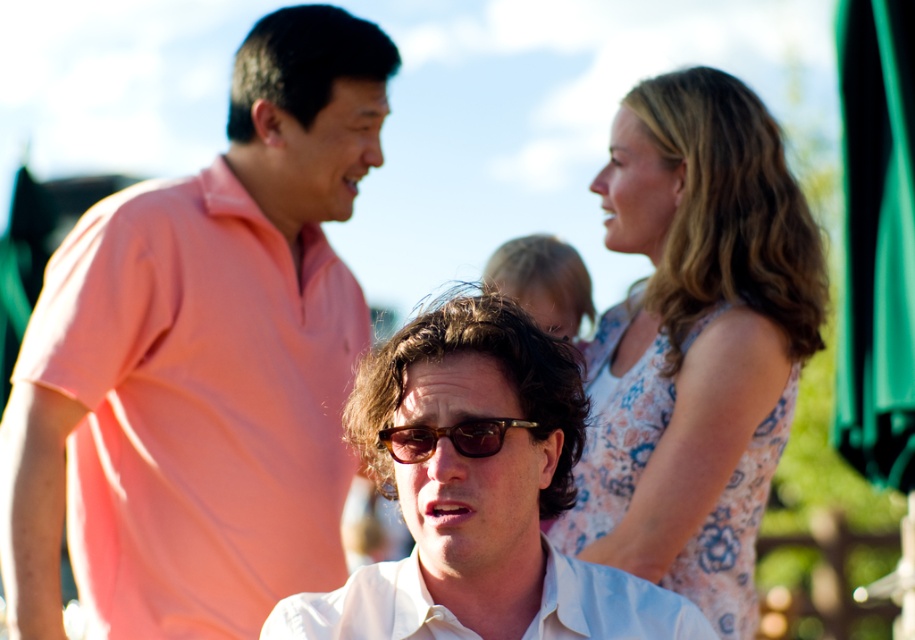
You are standing at the origin of the coordinate system in the image. You see two points labeled as point (138, 372) and point (417, 429). Which point is closer to you?

Point (417, 429) is closer to you because it is in front of point (138, 372).

You are organizing a photo shoot and need to position the models so that the floral dress at upper right and the white cotton shirt at center are visible in the frame. Based on their current positions, which model is higher up in the image?

The floral dress at upper right is located above the white cotton shirt at center, so the model wearing the floral dress at upper right is higher up in the image.

You are organizing a photo shoot and need to ensure that all clothing items are visible in the final image. Given the current setup, will the pink cotton shirt at left be clearly visible compared to the brown tortoiseshell sunglasses at center?

The pink cotton shirt at left has a larger size compared to the brown tortoiseshell sunglasses at center, so the pink cotton shirt at left will be more clearly visible in the photo shoot setup.